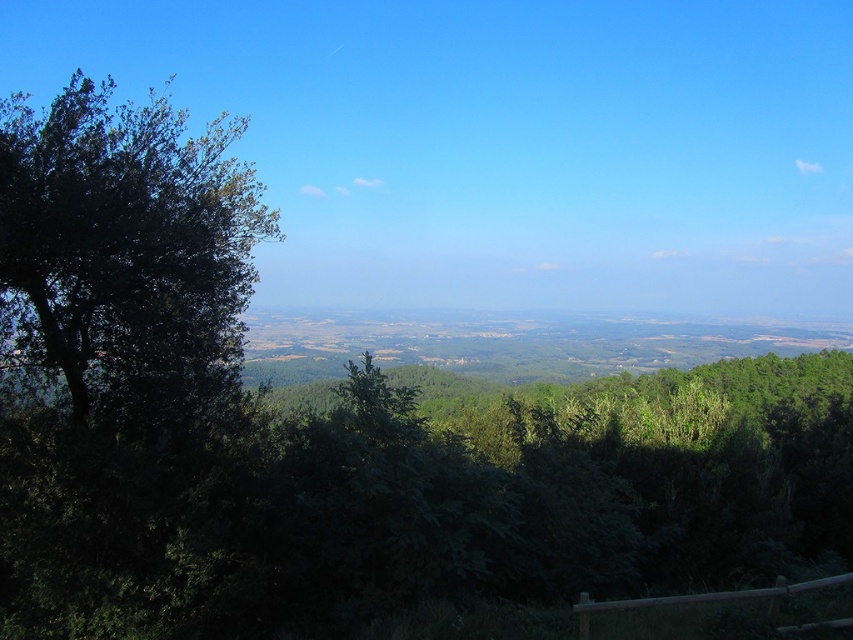
You are standing at the bottom right corner of the image where the wooden fence is visible. You want to walk towards the point marked as point (445, 552). However, there is an obstacle at point (152, 420). Will you encounter the obstacle before reaching your destination?

Yes, you will encounter the obstacle at point (152, 420) before reaching point (445, 552) because point (445, 552) is in front of point (152, 420), meaning the obstacle is closer to your starting position.